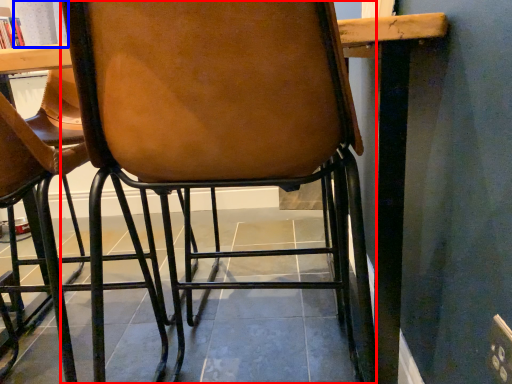
Question: Which object is closer to the camera taking this photo, chair (highlighted by a red box) or curtain (highlighted by a blue box)?

Choices:
 (A) chair
 (B) curtain

Answer: (A)